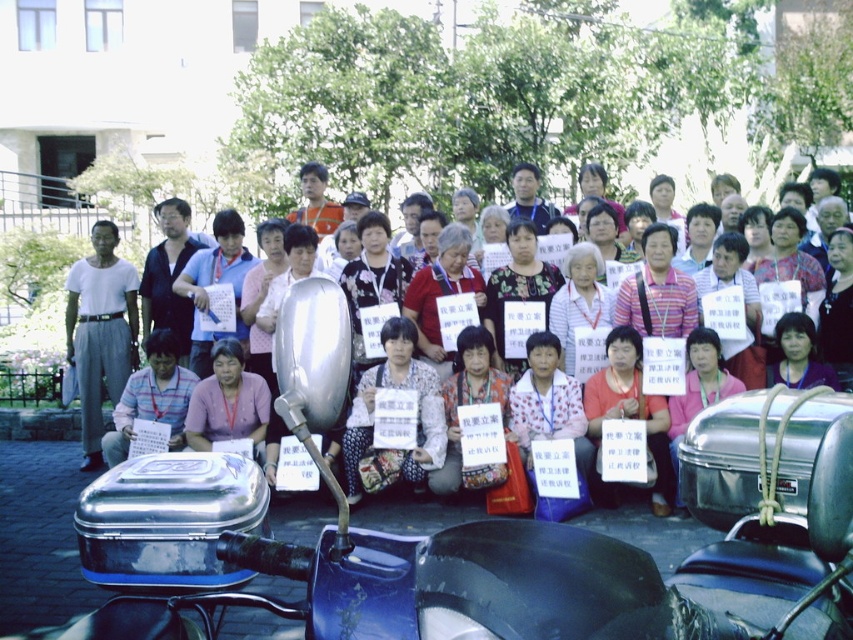
You are a photographer at the event and need to capture both the silver metallic helmet at center and the matte black sign at center in a single frame. Given their sizes, which object should you focus on to ensure both are clearly visible?

The silver metallic helmet at center is larger than the matte black sign at center, so focusing on the silver metallic helmet at center would allow both objects to be clearly visible in the frame.

You are a photographer trying to capture a clear photo of the matte black sign at center without any obstructions. There is a silver metallic helmet at center in the way. Can you adjust your angle to avoid the helmet while still framing the sign?

The silver metallic helmet at center is positioned over the matte black sign at center, so tilting the camera slightly downward or moving to the side could allow you to capture the matte black sign at center without the helmet obstructing it.